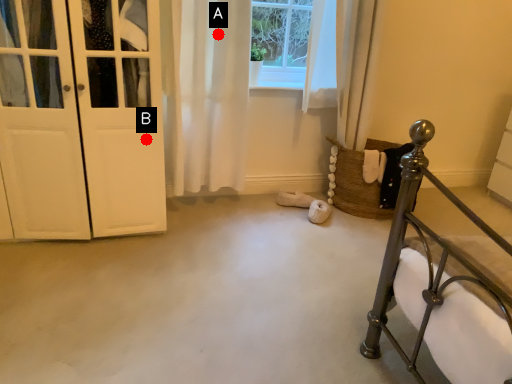
Question: Two points are circled on the image, labeled by A and B beside each circle. Among these points, which one is farthest from the camera?

Choices:
 (A) A is further
 (B) B is further

Answer: (A)